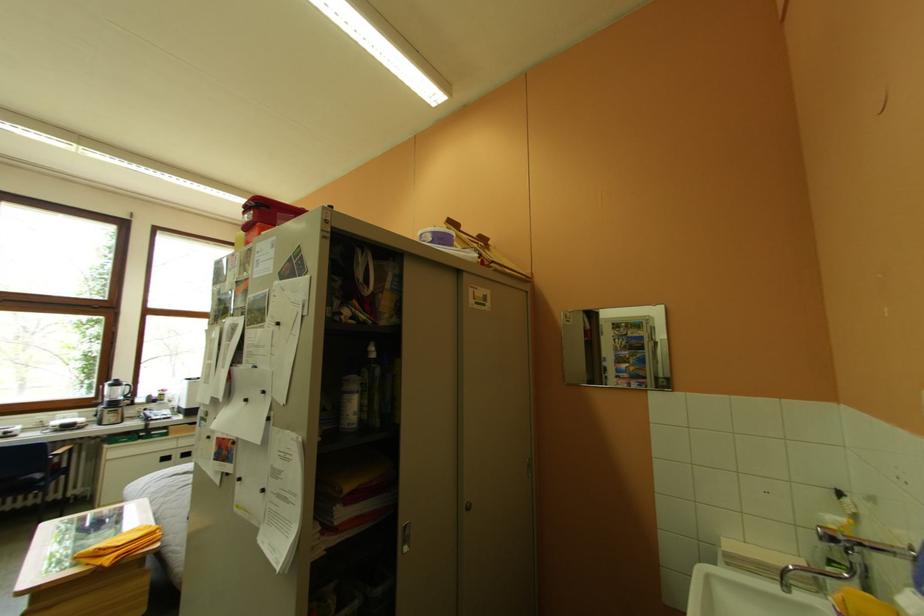
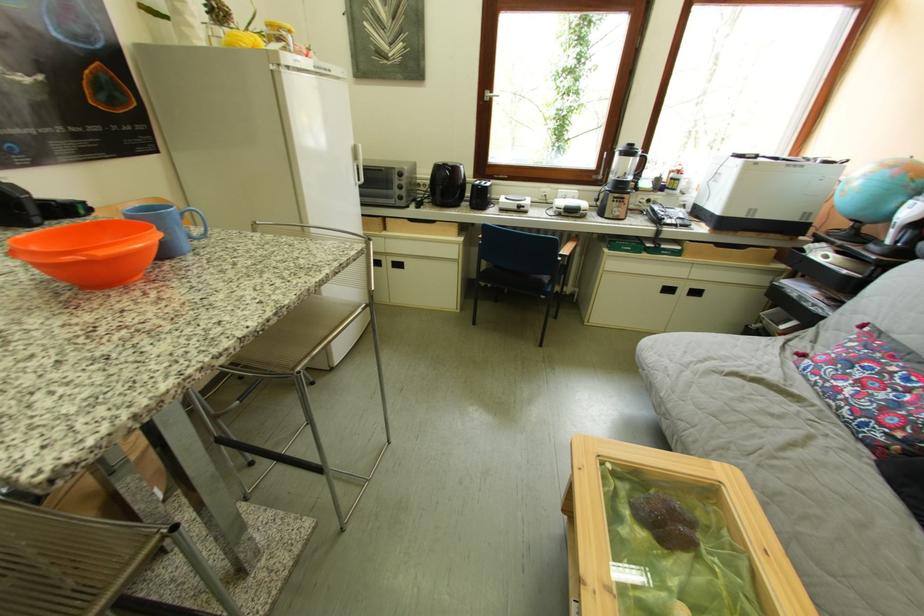
Locate, in the second image, the point that corresponds to pixel 188 459 in the first image.

(695, 294)